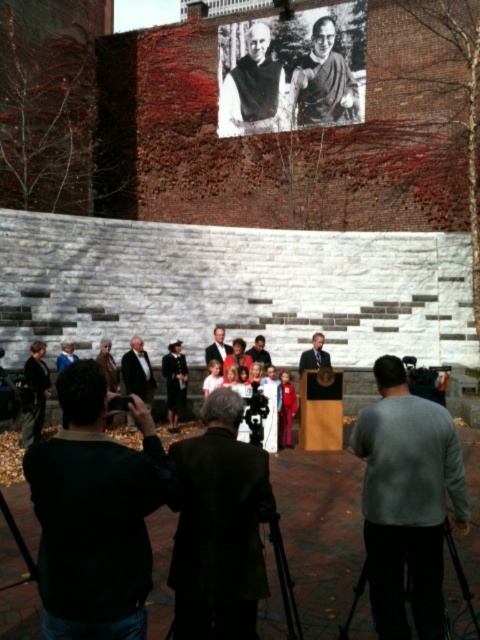
Is point (432, 508) positioned before point (311, 362)?

Yes, point (432, 508) is closer to viewer.

Measure the distance between gray cotton shirt at lower right and camera.

The distance of gray cotton shirt at lower right from camera is 16.18 meters.

At what (x,y) coordinates should I click in order to perform the action: click on gray cotton shirt at lower right. Please return your answer as a coordinate pair (x, y). Image resolution: width=480 pixels, height=640 pixels. Looking at the image, I should click on (407, 500).

Can you confirm if black matte tripod at center is wider than black matte tripod at lower right?

Indeed, black matte tripod at center has a greater width compared to black matte tripod at lower right.

Does black matte tripod at center appear over black matte tripod at lower right?

Yes, black matte tripod at center is above black matte tripod at lower right.

Is point (295, 602) in front of point (359, 592)?

Yes, point (295, 602) is in front of point (359, 592).

At what (x,y) coordinates should I click in order to perform the action: click on black matte tripod at center. Please return your answer as a coordinate pair (x, y). Image resolution: width=480 pixels, height=640 pixels. Looking at the image, I should click on (285, 580).

Locate an element on the screen. dark suit at center is located at coordinates (137, 371).

From the picture: Can you confirm if dark suit at center is positioned below black matte tripod at lower right?

Incorrect, dark suit at center is not positioned below black matte tripod at lower right.

The height and width of the screenshot is (640, 480). I want to click on dark suit at center, so click(x=137, y=371).